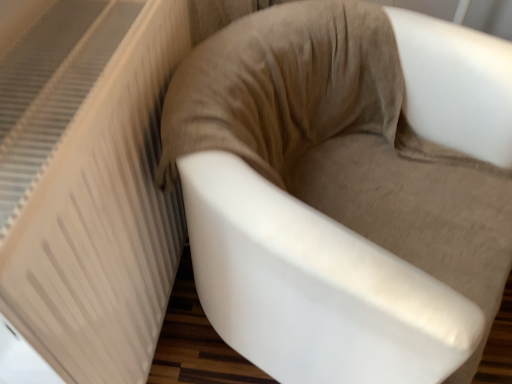
Question: Considering the relative sizes of white textured radiator at left and suede-like beige chair at center in the image provided, is white textured radiator at left taller than suede-like beige chair at center?

Choices:
 (A) no
 (B) yes

Answer: (B)

Question: Is white textured radiator at left positioned before suede-like beige chair at center?

Choices:
 (A) no
 (B) yes

Answer: (B)

Question: Is white textured radiator at left oriented towards suede-like beige chair at center?

Choices:
 (A) no
 (B) yes

Answer: (B)

Question: Is white textured radiator at left far away from suede-like beige chair at center?

Choices:
 (A) no
 (B) yes

Answer: (A)

Question: Is white textured radiator at left directly adjacent to suede-like beige chair at center?

Choices:
 (A) no
 (B) yes

Answer: (A)

Question: Can you confirm if white textured radiator at left is positioned to the right of suede-like beige chair at center?

Choices:
 (A) no
 (B) yes

Answer: (A)

Question: Is suede-like beige chair at center wider than white textured radiator at left?

Choices:
 (A) yes
 (B) no

Answer: (A)

Question: Does suede-like beige chair at center lie in front of white textured radiator at left?

Choices:
 (A) no
 (B) yes

Answer: (A)

Question: Does suede-like beige chair at center come behind white textured radiator at left?

Choices:
 (A) no
 (B) yes

Answer: (B)

Question: Does suede-like beige chair at center turn towards white textured radiator at left?

Choices:
 (A) no
 (B) yes

Answer: (A)

Question: From a real-world perspective, is suede-like beige chair at center on white textured radiator at left?

Choices:
 (A) no
 (B) yes

Answer: (A)

Question: Considering the relative sizes of suede-like beige chair at center and white textured radiator at left in the image provided, is suede-like beige chair at center thinner than white textured radiator at left?

Choices:
 (A) yes
 (B) no

Answer: (B)

Question: Does point (318, 102) appear closer or farther from the camera than point (92, 249)?

Choices:
 (A) closer
 (B) farther

Answer: (B)